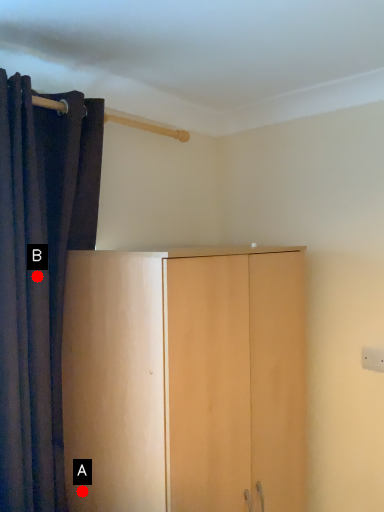
Question: Two points are circled on the image, labeled by A and B beside each circle. Which point appears closest to the camera in this image?

Choices:
 (A) A is closer
 (B) B is closer

Answer: (B)